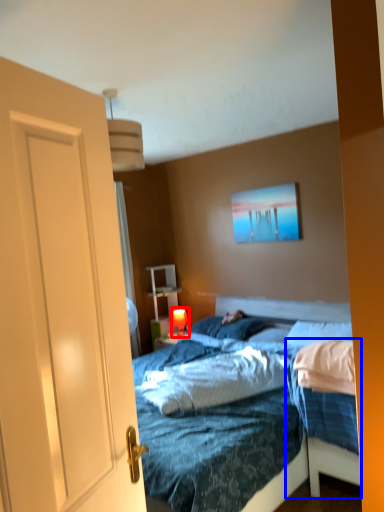
Question: Among these objects, which one is farthest to the camera, table lamp (highlighted by a red box) or bed frame (highlighted by a blue box)?

Choices:
 (A) table lamp
 (B) bed frame

Answer: (A)